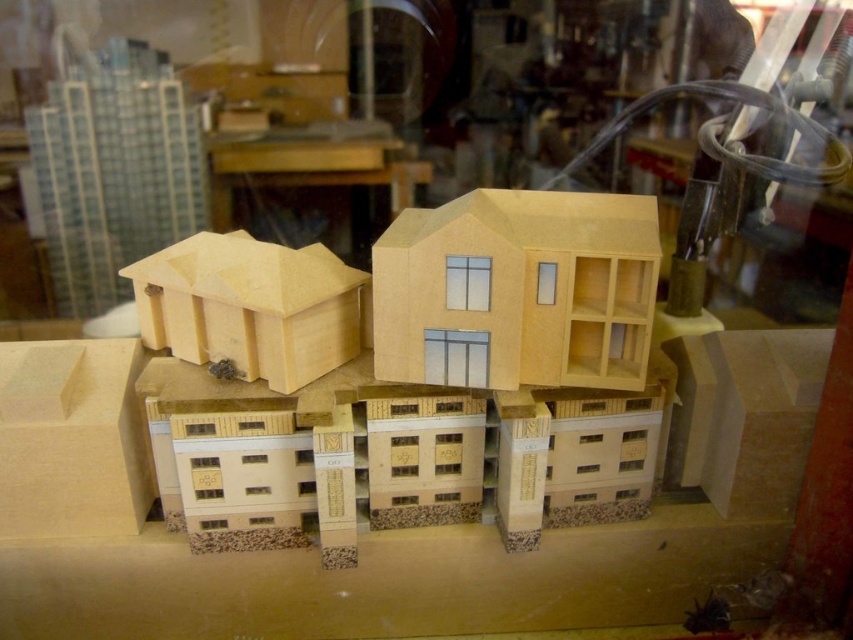
You are an architect examining the miniature models in the studio. You notice two windows in the scene. The first is the clear glass window at center, and the second is the transparent glass shop window at center. Which of these windows is bigger?

The clear glass window at center is larger in size than the transparent glass shop window at center, so the clear glass window at center is bigger.

You are an architect reviewing the miniature models. You notice two shop windows in the scene. Which one is larger? The clear glass shop window at center or the transparent glass shop window at center?

The clear glass shop window at center is bigger than the transparent glass shop window at center, so the clear glass shop window at center is larger.